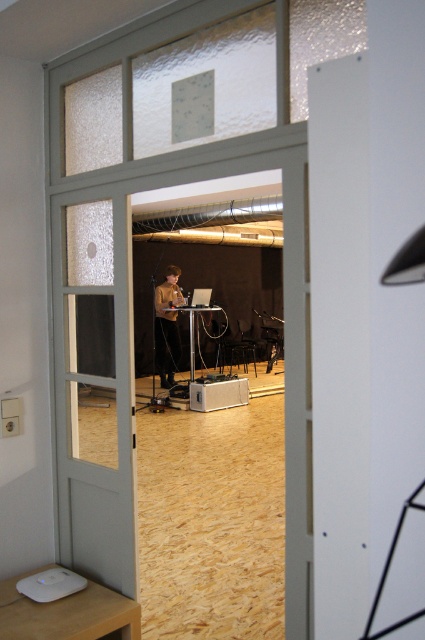
Is the position of clear glass door at center less distant than that of matte brown sweater at center?

Yes.

Which is in front, point (112, 428) or point (156, 296)?

Point (112, 428) is in front.

Is point (73, 317) closer to viewer compared to point (172, 346)?

That is True.

At what (x,y) coordinates should I click in order to perform the action: click on clear glass door at center. Please return your answer as a coordinate pair (x, y). The height and width of the screenshot is (640, 425). Looking at the image, I should click on (93, 390).